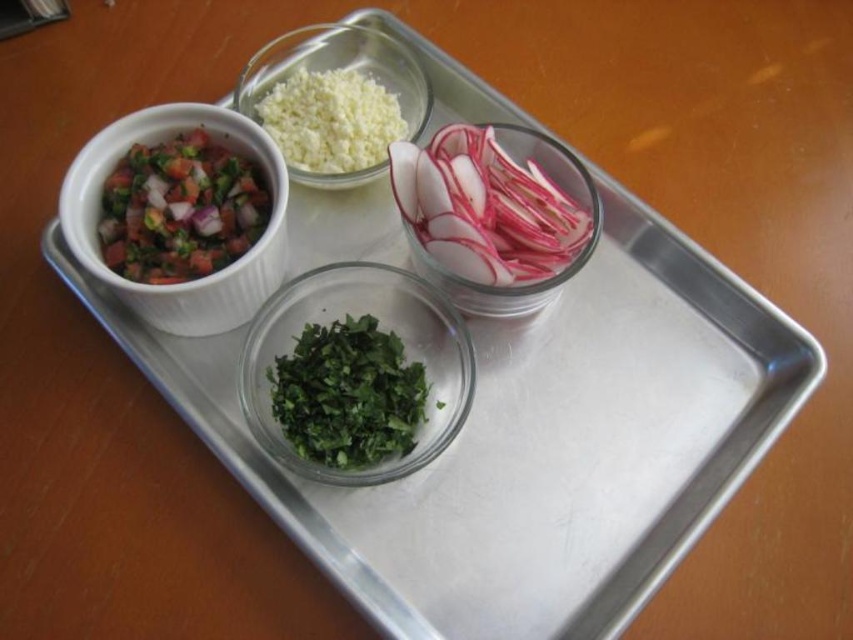
You are holding a spoon that is 20 centimeters long. You want to reach the point at coordinates point (257,192) on the metal tray to pick up some ingredients. Can your spoon reach that point from your current position?

The point at coordinates point (257,192) is 54.22 centimeters away from the camera. Since the spoon is only 20 centimeters long, it cannot reach the point at coordinates point (257,192).

You are standing at the edge of the wooden surface where the metal tray is placed. You want to pick up the chopped tomato salad at upper left, but you can only reach 45 centimeters forward. Can you reach it?

The chopped tomato salad at upper left is 50.07 centimeters away from the viewer. Since your reach is only 45 centimeters, you cannot reach it without moving closer.